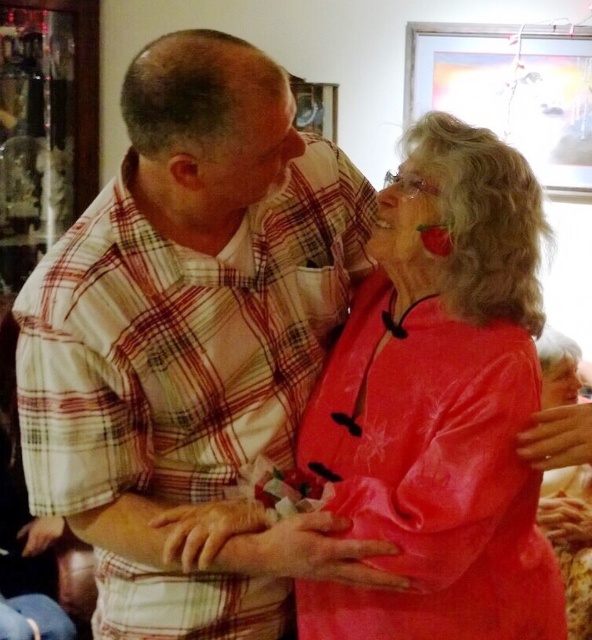
Question: Among these points, which one is nearest to the camera?

Choices:
 (A) (429, 429)
 (B) (564, 392)
 (C) (249, 141)

Answer: (C)

Question: Can you confirm if matte plaid shirt at upper center is positioned below matte pink fabric at upper right?

Choices:
 (A) yes
 (B) no

Answer: (B)

Question: Which point is farther to the camera?

Choices:
 (A) smooth skin face at center
 (B) matte pink fabric at upper right

Answer: (A)

Question: Does matte plaid shirt at upper center appear under matte pink fabric at upper right?

Choices:
 (A) yes
 (B) no

Answer: (B)

Question: Among these points, which one is nearest to the camera?

Choices:
 (A) (558, 358)
 (B) (406, 228)
 (C) (436, 220)
 (D) (296, 131)

Answer: (C)

Question: Is matte plaid shirt at upper center to the left of matte pink fabric at upper right from the viewer's perspective?

Choices:
 (A) yes
 (B) no

Answer: (A)